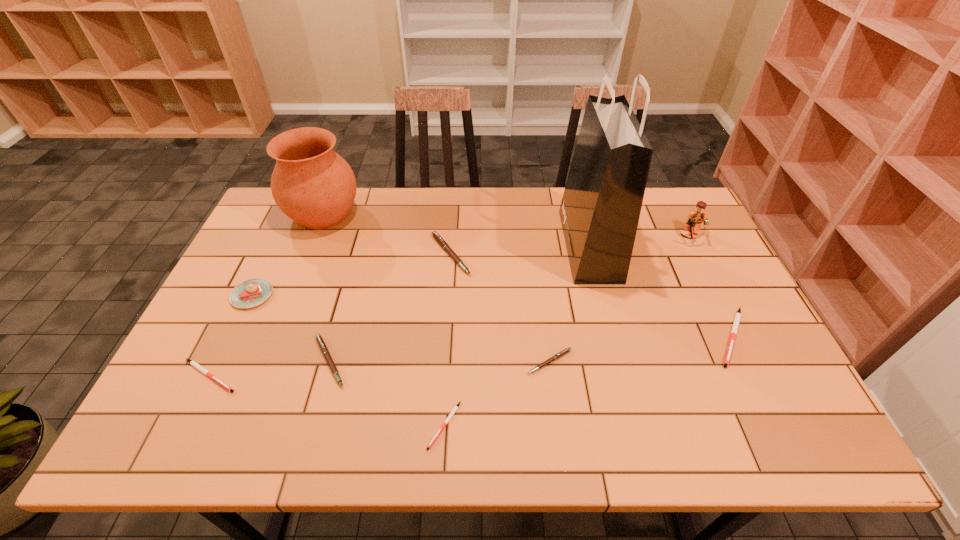
You are a GUI agent. You are given a task and a screenshot of the screen. Output one action in this format:
    pyautogui.click(x=<x>, y=<y>)
    Task: Click on the pink pen object that ranks as the third closest to the pottery
    This screenshot has width=960, height=540.
    Given the screenshot: What is the action you would take?
    pyautogui.click(x=563, y=352)

Where is `the second closest white pen to the biggest pink pen`? the second closest white pen to the biggest pink pen is located at coordinates (193, 363).

Locate which white pen is the second closest to the leftmost pink pen. Please provide its 2D coordinates. Your answer should be formatted as a tuple, i.e. [(x, y)], where the tuple contains the x and y coordinates of a point satisfying the conditions above.

[(451, 414)]

You are a GUI agent. You are given a task and a screenshot of the screen. Output one action in this format:
    pyautogui.click(x=<x>, y=<y>)
    Task: Click on the vacant space that satisfies the following two spatial constraints: 1. holding a crossbow in the hands of the Lego; 2. at the nib of the farthest pink pen
    
    Given the screenshot: What is the action you would take?
    [x=699, y=254]

The width and height of the screenshot is (960, 540). I want to click on free space in the image that satisfies the following two spatial constraints: 1. on the back side of the pottery; 2. on the right side of the seventh shortest object, so click(x=292, y=213).

At what (x,y) coordinates should I click in order to perform the action: click on vacant space that satisfies the following two spatial constraints: 1. on the clicker of the rightmost white pen; 2. at the nib of the second pen from left to right. Please return your answer as a coordinate pair (x, y). Looking at the image, I should click on (744, 361).